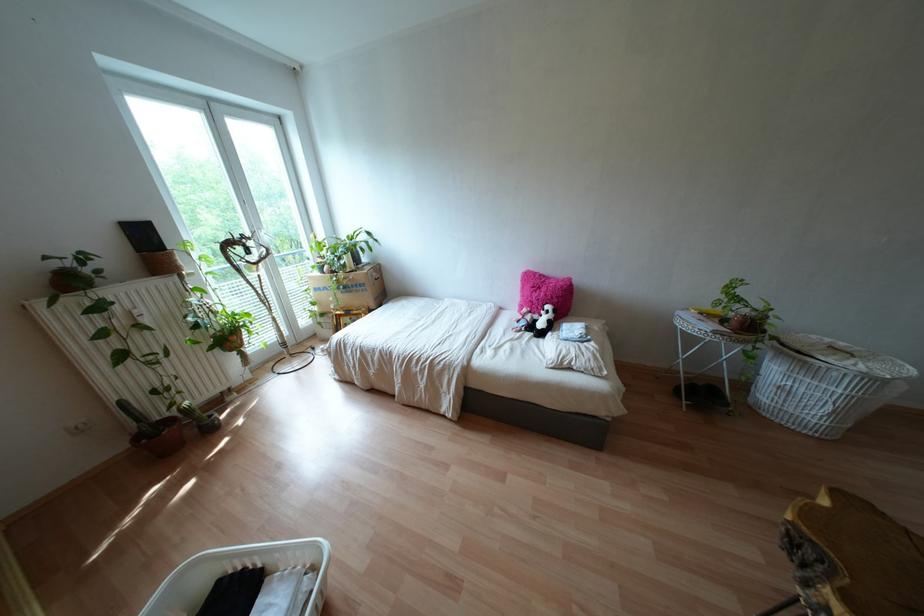
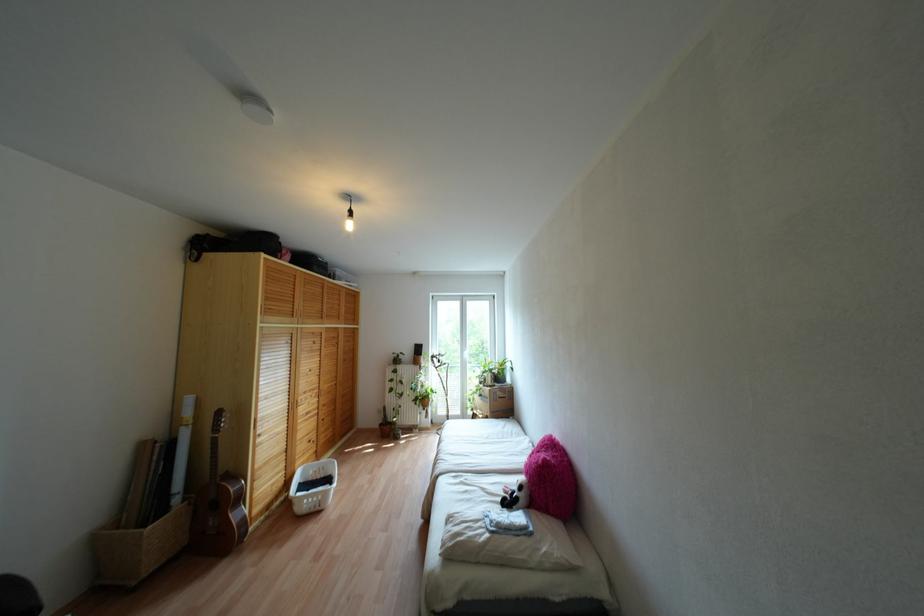
The point at (512, 339) is marked in the first image. Where is the corresponding point in the second image?

(482, 488)